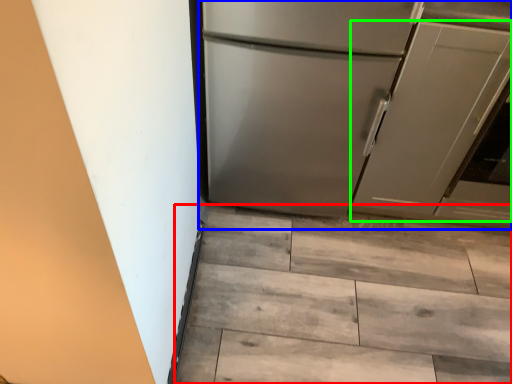
Question: Based on their relative distances, which object is farther from stairwell (highlighted by a red box)? Choose from refrigerator (highlighted by a blue box) and door (highlighted by a green box).

Choices:
 (A) refrigerator
 (B) door

Answer: (B)